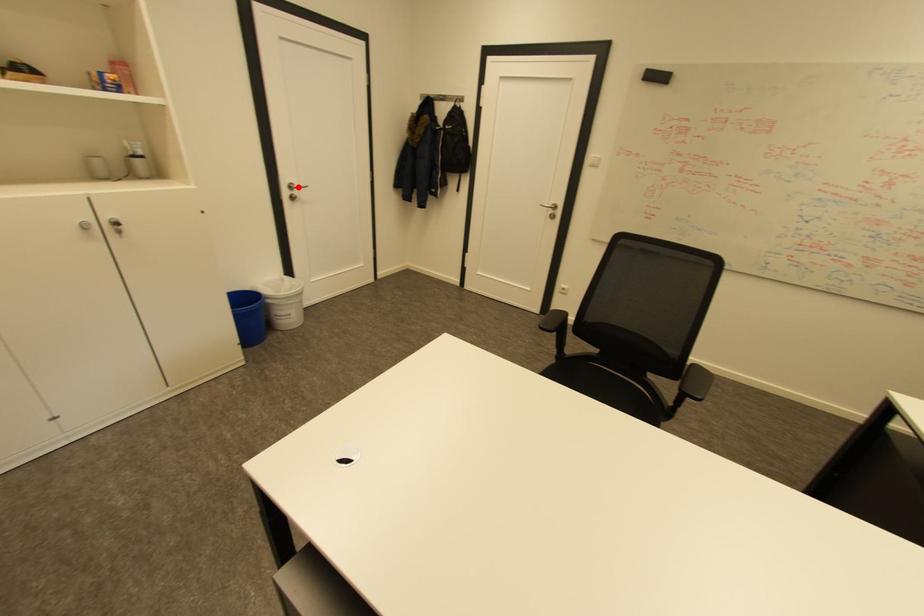
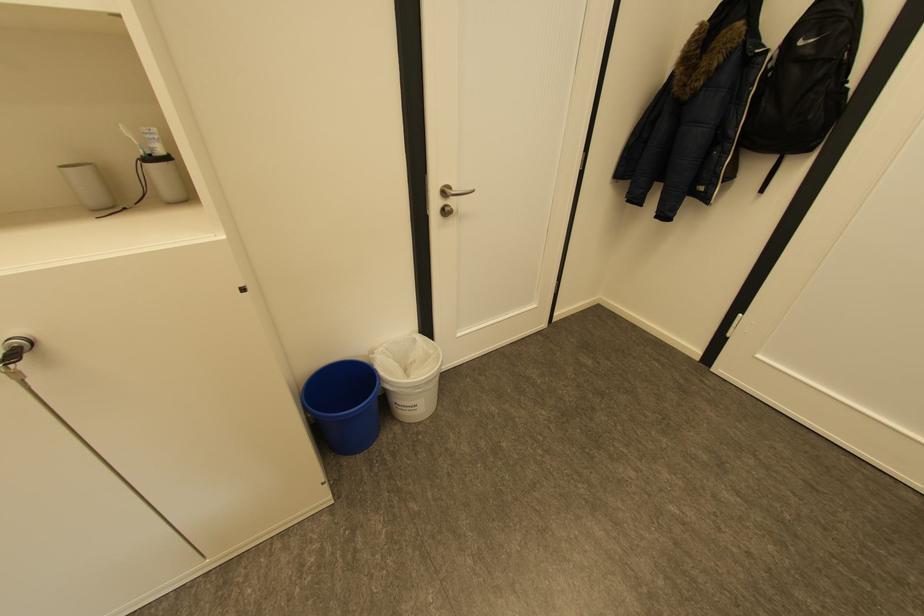
Find the pixel in the second image that matches the highlighted location in the first image.

(451, 192)